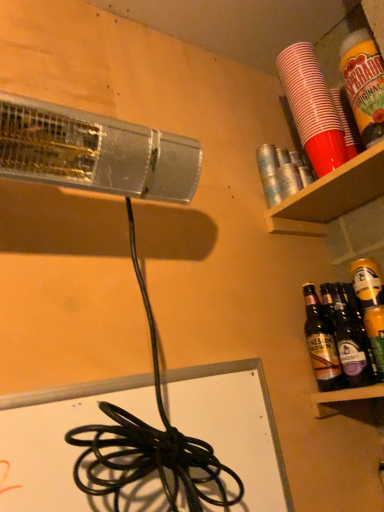
Question: Relative to dark brown glass bottle at lower right, the first bottle from the right, is gold matte can at right in front or behind?

Choices:
 (A) front
 (B) behind

Answer: (B)

Question: From their relative heights in the image, would you say gold matte can at right is taller or shorter than dark brown glass bottle at lower right, the 2th bottle in the left-to-right sequence?

Choices:
 (A) tall
 (B) short

Answer: (B)

Question: Considering the real-world distances, which object is farthest from the orange plastic cup at upper right, the second beverage positioned from the back?

Choices:
 (A) red plastic cups at upper right
 (B) brown glass bottles at right, the 2th bottle when ordered from right to left
 (C) red plastic cups at upper right, which appears as the first beverage when viewed from the back
 (D) dark brown glass bottle at lower right, the first bottle from the right
 (E) gold matte can at right

Answer: (B)

Question: Based on their relative distances, which object is farther from the red plastic cups at upper right, the 2th beverage positioned from the front?

Choices:
 (A) brown glass bottles at right, arranged as the first bottle when viewed from the left
 (B) orange plastic cup at upper right, the second beverage positioned from the back
 (C) red plastic cups at upper right
 (D) dark brown glass bottle at lower right, the 2th bottle in the left-to-right sequence
 (E) gold matte can at right

Answer: (A)